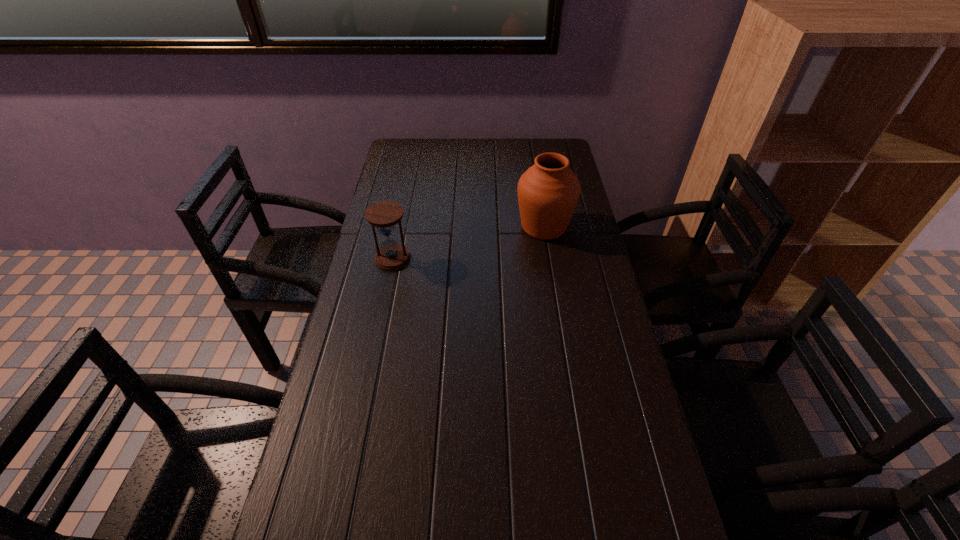
This screenshot has width=960, height=540. In the image, there is a desktop. In order to click on blank space at the right edge in this screenshot , I will do `click(644, 474)`.

You are a GUI agent. You are given a task and a screenshot of the screen. Output one action in this format:
    pyautogui.click(x=<x>, y=<y>)
    Task: Click on the vacant position at the far right corner of the desktop
    This screenshot has width=960, height=540.
    Given the screenshot: What is the action you would take?
    pyautogui.click(x=529, y=154)